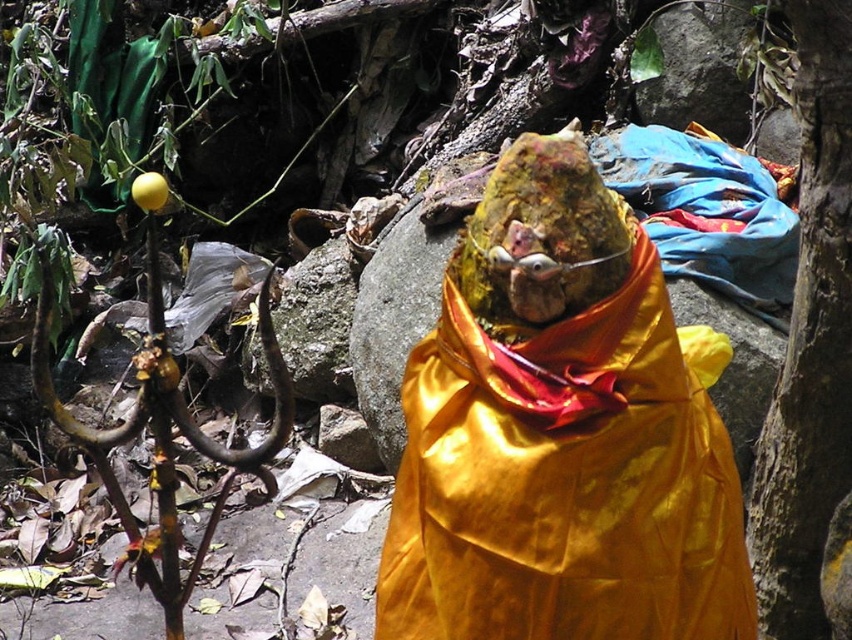
You are a tour guide leading a group through a jungle. You want to ensure that your group can see the shiny gold statue at center clearly from where they are standing. The average person in your group has a viewing range of 1.5 meters. Can they see the statue clearly from their current position?

The shiny gold statue at center is 1.60 meters away from the viewer. Since the average viewing range is 1.5 meters, the group may have difficulty seeing the statue clearly from their current position and might need to move closer.

You are an explorer in a jungle and need to decide which object is shorter between the shiny gold statue at center and the smooth brown bark at right. Which one is shorter?

The shiny gold statue at center is shorter than the smooth brown bark at right.